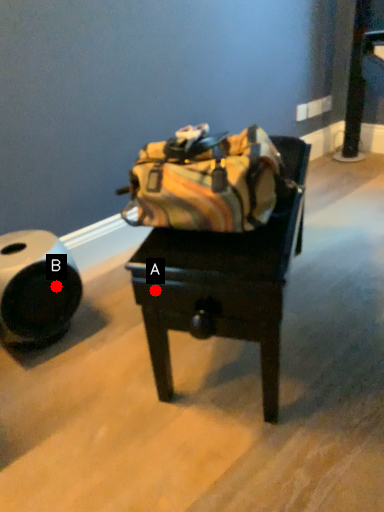
Question: Two points are circled on the image, labeled by A and B beside each circle. Which point is farther from the camera taking this photo?

Choices:
 (A) A is further
 (B) B is further

Answer: (B)